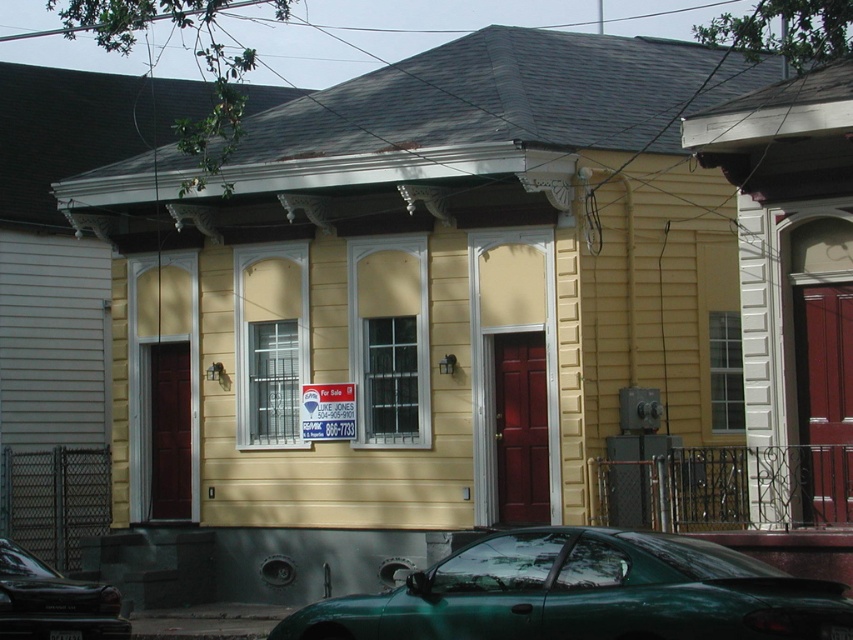
What do you see at coordinates (53, 602) in the screenshot? I see `metallic green car at lower center` at bounding box center [53, 602].

Can you confirm if metallic green car at lower center is smaller than red plastic sign at center?

Actually, metallic green car at lower center might be larger than red plastic sign at center.

The image size is (853, 640). Describe the element at coordinates (53, 602) in the screenshot. I see `metallic green car at lower center` at that location.

This screenshot has width=853, height=640. Identify the location of metallic green car at lower center. (53, 602).

Does green matte car at lower center have a lesser width compared to red plastic sign at center?

No.

Who is positioned more to the right, green matte car at lower center or red plastic sign at center?

Positioned to the right is green matte car at lower center.

Which is in front, point (525, 552) or point (331, 406)?

Positioned in front is point (525, 552).

I want to click on green matte car at lower center, so click(x=585, y=593).

Is green matte car at lower center bigger than metallic green car at lower center?

Indeed, green matte car at lower center has a larger size compared to metallic green car at lower center.

Does green matte car at lower center have a lesser height compared to metallic green car at lower center?

No.

Is point (386, 621) more distant than point (55, 618)?

No.

Where is `green matte car at lower center`? This screenshot has height=640, width=853. green matte car at lower center is located at coordinates (585, 593).